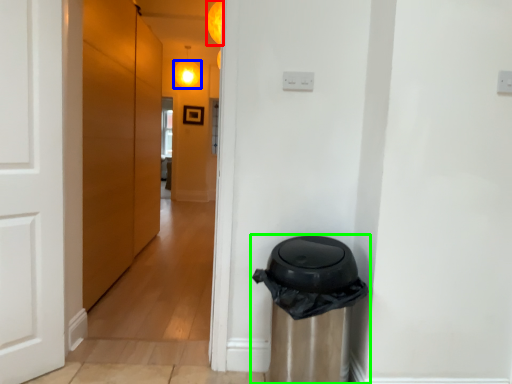
Question: Based on their relative distances, which object is nearer to light (highlighted by a red box)? Choose from light (highlighted by a blue box) and waste container (highlighted by a green box).

Choices:
 (A) light
 (B) waste container

Answer: (B)